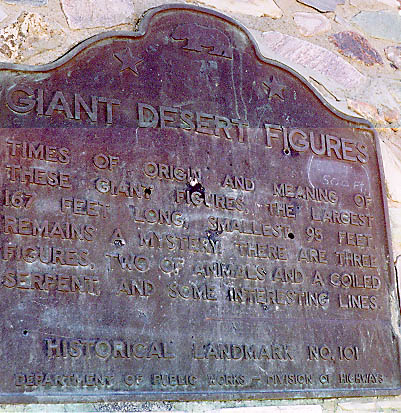
You are a GUI agent. You are given a task and a screenshot of the screen. Output one action in this format:
    pyautogui.click(x=<x>, y=<y>)
    Task: Click on the old metal plaque
    Image resolution: width=401 pixels, height=413 pixels.
    Given the screenshot: What is the action you would take?
    pyautogui.click(x=62, y=64)